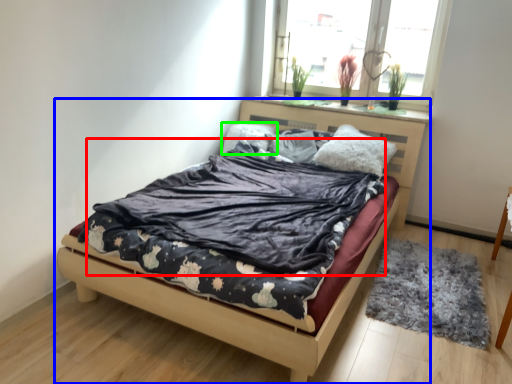
Question: Which is farther away from blanket (highlighted by a red box)? bed (highlighted by a blue box) or pillow (highlighted by a green box)?

Choices:
 (A) bed
 (B) pillow

Answer: (B)